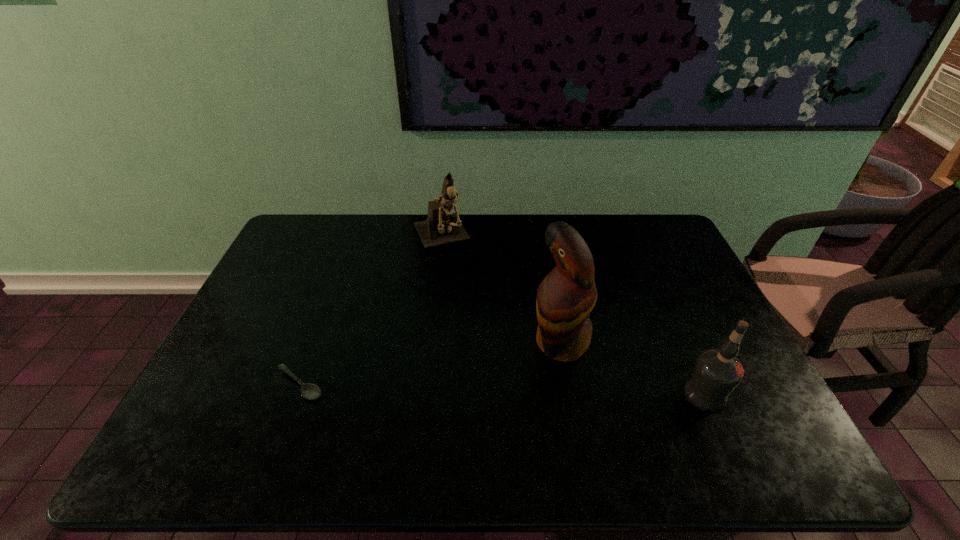
This screenshot has height=540, width=960. In order to click on free spot between the third object from left to right and the third shortest object in this screenshot , I will do `click(501, 290)`.

Locate an element on the screen. free space between the parrot and the vodka is located at coordinates (633, 368).

This screenshot has width=960, height=540. I want to click on blank region between the vodka and the shortest object, so click(502, 389).

Identify the location of vacant area that lies between the third nearest object and the shortest object. The image size is (960, 540). (430, 363).

Identify the location of vacant point located between the third nearest object and the shortest object. This screenshot has height=540, width=960. (430, 363).

What are the coordinates of `object that is the third closest to the vodka` in the screenshot? It's located at 309,391.

Where is `object identified as the second closest to the figurine`? Image resolution: width=960 pixels, height=540 pixels. object identified as the second closest to the figurine is located at coordinates (309, 391).

The image size is (960, 540). I want to click on free region that satisfies the following two spatial constraints: 1. on the front side of the third shortest object; 2. on the front label of the vodka, so click(x=423, y=394).

Locate an element on the screen. The width and height of the screenshot is (960, 540). vacant space that satisfies the following two spatial constraints: 1. on the back side of the tallest object; 2. on the left side of the leftmost object is located at coordinates (316, 342).

Where is `free space that satisfies the following two spatial constraints: 1. on the front side of the shortest object; 2. on the front label of the rightmost object`? This screenshot has height=540, width=960. free space that satisfies the following two spatial constraints: 1. on the front side of the shortest object; 2. on the front label of the rightmost object is located at coordinates (297, 394).